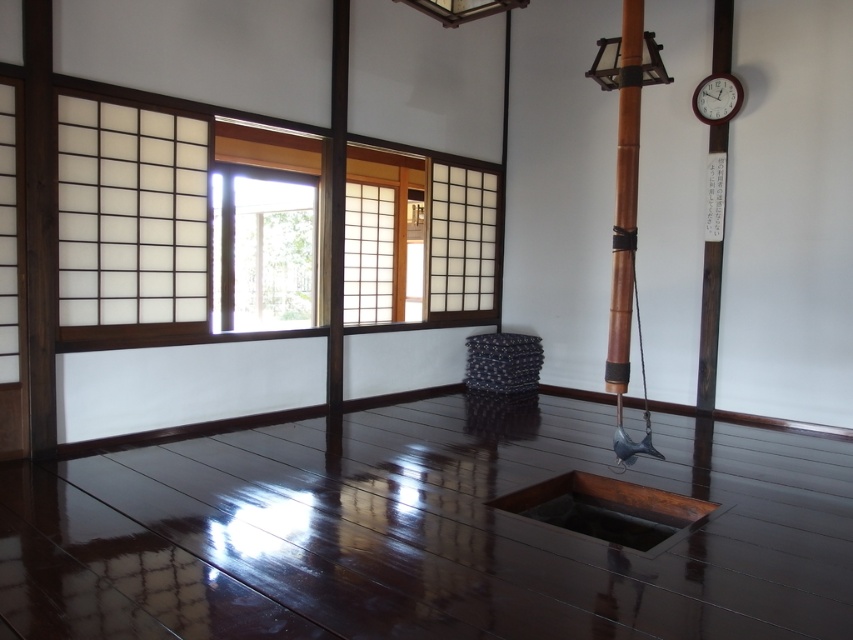
You are an interior designer assessing the placement of items in a traditional Japanese room. You need to determine if the white plastic clock at upper right can be moved closer to the wooden textured lampshade at upper center without overlapping them. Given their heights, is this possible?

The white plastic clock at upper right is taller than the wooden textured lampshade at upper center. Since height differences do not affect horizontal placement, the clock can be moved closer as long as there is enough space between them horizontally.

You are standing in the traditional Japanese room and want to reach the wooden lantern at upper center. The room has a small square opening in the floor. Can you safely step over the opening to approach the lantern?

The wooden lantern at upper center is 4.12 meters away from viewer. Since the opening is small and the distance is manageable, stepping over the opening to approach the lantern should be safe as long as you are cautious.